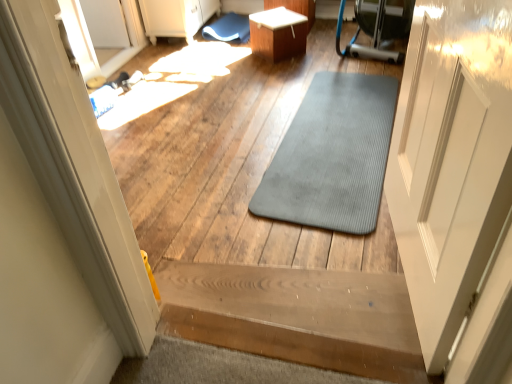
Consider the image. Measure the distance between wooden stairs at center and camera.

A distance of 1.05 meters exists between wooden stairs at center and camera.

The width and height of the screenshot is (512, 384). What do you see at coordinates (228, 29) in the screenshot?
I see `blue rubber bath mat at upper center` at bounding box center [228, 29].

Describe the element at coordinates (278, 33) in the screenshot. I see `white glossy table at upper center` at that location.

This screenshot has height=384, width=512. Find the location of `white glossy table at upper center`. white glossy table at upper center is located at coordinates click(x=278, y=33).

Describe the element at coordinates (113, 31) in the screenshot. I see `transparent glass door at upper left` at that location.

This screenshot has height=384, width=512. I want to click on gray rubber mat at center, so click(332, 155).

Considering the sizes of objects gray rubber mat at center and transparent glass door at upper left in the image provided, who is shorter, gray rubber mat at center or transparent glass door at upper left?

gray rubber mat at center.

Is point (343, 180) more distant than point (127, 20)?

No.

What's the angular difference between gray rubber mat at center and transparent glass door at upper left's facing directions?

91.6 degrees.

Is gray rubber mat at center inside the boundaries of transparent glass door at upper left, or outside?

gray rubber mat at center lies outside transparent glass door at upper left.

Measure the distance from blue rubber bath mat at upper center to white glossy table at upper center.

blue rubber bath mat at upper center and white glossy table at upper center are 20.06 inches apart.

Are blue rubber bath mat at upper center and white glossy table at upper center far apart?

No, blue rubber bath mat at upper center is not far from white glossy table at upper center.

Which is less distant, (244, 38) or (286, 10)?

Point (244, 38) appears to be farther away from the viewer than point (286, 10).

Is blue rubber bath mat at upper center positioned with its back to white glossy table at upper center?

blue rubber bath mat at upper center does not have its back to white glossy table at upper center.

Looking at this image, considering the sizes of objects wooden stairs at center and transparent glass door at upper left in the image provided, who is thinner, wooden stairs at center or transparent glass door at upper left?

transparent glass door at upper left is thinner.

Choose the correct answer: Is wooden stairs at center inside transparent glass door at upper left or outside it?

wooden stairs at center is spatially situated outside transparent glass door at upper left.

From a real-world perspective, who is located lower, wooden stairs at center or transparent glass door at upper left?

In real-world perspective, wooden stairs at center is lower.

Image resolution: width=512 pixels, height=384 pixels. What are the coordinates of `stairs below the transparent glass door at upper left (from a real-world perspective)` in the screenshot? It's located at (296, 316).

Is transparent glass door at upper left oriented away from blue rubber bath mat at upper center?

No.

Is transparent glass door at upper left to the right of blue rubber bath mat at upper center from the viewer's perspective?

No.

Consider the image. From the image's perspective, is transparent glass door at upper left above blue rubber bath mat at upper center?

No, from the image's perspective, transparent glass door at upper left is not over blue rubber bath mat at upper center.

Does transparent glass door at upper left have a lesser height compared to blue rubber bath mat at upper center?

No, transparent glass door at upper left is not shorter than blue rubber bath mat at upper center.

Is point (317, 133) positioned in front of point (212, 341)?

No, it is behind (212, 341).

In the image, is gray rubber mat at center positioned in front of or behind wooden stairs at center?

In the image, gray rubber mat at center appears behind wooden stairs at center.

From the image's perspective, does gray rubber mat at center appear lower than wooden stairs at center?

Incorrect, from the image's perspective, gray rubber mat at center is higher than wooden stairs at center.

Between gray rubber mat at center and wooden stairs at center, which one has larger size?

With larger size is wooden stairs at center.

Considering the sizes of white glossy table at upper center and gray rubber mat at center in the image, is white glossy table at upper center taller or shorter than gray rubber mat at center?

Considering their sizes, white glossy table at upper center has more height than gray rubber mat at center.

How many degrees apart are the facing directions of white glossy table at upper center and gray rubber mat at center?

The facing directions of white glossy table at upper center and gray rubber mat at center are 38.7 degrees apart.

Which of these two, white glossy table at upper center or gray rubber mat at center, is thinner?

Thinner between the two is white glossy table at upper center.

At what (x,y) coordinates should I click in order to perform the action: click on table that is above the gray rubber mat at center (from a real-world perspective). Please return your answer as a coordinate pair (x, y). The height and width of the screenshot is (384, 512). Looking at the image, I should click on (278, 33).

How many degrees apart are the facing directions of wooden stairs at center and blue rubber bath mat at upper center?

175 degrees separate the facing orientations of wooden stairs at center and blue rubber bath mat at upper center.

At what (x,y) coordinates should I click in order to perform the action: click on stairs on the right of blue rubber bath mat at upper center. Please return your answer as a coordinate pair (x, y). The width and height of the screenshot is (512, 384). Looking at the image, I should click on (296, 316).

Which is closer, (305, 330) or (208, 29)?

Clearly, point (305, 330) is closer to the camera than point (208, 29).

At what (x,y) coordinates should I click in order to perform the action: click on mat below the transparent glass door at upper left (from the image's perspective). Please return your answer as a coordinate pair (x, y). This screenshot has width=512, height=384. Looking at the image, I should click on (332, 155).

The width and height of the screenshot is (512, 384). In the image, there is a white glossy table at upper center. What are the coordinates of `bath mat above it (from the image's perspective)` in the screenshot? It's located at (228, 29).

Considering their positions, is transparent glass door at upper left positioned further to blue rubber bath mat at upper center than white glossy table at upper center?

transparent glass door at upper left is positioned further to the anchor blue rubber bath mat at upper center.

Considering their positions, is wooden stairs at center positioned further to gray rubber mat at center than white glossy table at upper center?

Based on the image, white glossy table at upper center appears to be further to gray rubber mat at center.

Looking at the image, which one is located further to white glossy table at upper center, transparent glass door at upper left or gray rubber mat at center?

transparent glass door at upper left is positioned further to the anchor white glossy table at upper center.

Considering their positions, is transparent glass door at upper left positioned closer to white glossy table at upper center than blue rubber bath mat at upper center?

blue rubber bath mat at upper center lies closer to white glossy table at upper center than the other object.

Consider the image. Considering their positions, is gray rubber mat at center positioned closer to blue rubber bath mat at upper center than white glossy table at upper center?

white glossy table at upper center is positioned closer to the anchor blue rubber bath mat at upper center.

Estimate the real-world distances between objects in this image. Which object is closer to blue rubber bath mat at upper center, white glossy table at upper center or wooden stairs at center?

Among the two, white glossy table at upper center is located nearer to blue rubber bath mat at upper center.

Based on their spatial positions, is white glossy table at upper center or gray rubber mat at center closer to blue rubber bath mat at upper center?

Among the two, white glossy table at upper center is located nearer to blue rubber bath mat at upper center.

Considering their positions, is blue rubber bath mat at upper center positioned closer to wooden stairs at center than transparent glass door at upper left?

transparent glass door at upper left.

At what (x,y) coordinates should I click in order to perform the action: click on table between gray rubber mat at center and blue rubber bath mat at upper center along the z-axis. Please return your answer as a coordinate pair (x, y). This screenshot has height=384, width=512. Looking at the image, I should click on (278, 33).

Identify the location of glass door located between wooden stairs at center and blue rubber bath mat at upper center in the depth direction. [113, 31].

You are a GUI agent. You are given a task and a screenshot of the screen. Output one action in this format:
    pyautogui.click(x=<x>, y=<y>)
    Task: Click on the mat between transparent glass door at upper left and wooden stairs at center vertically
    
    Given the screenshot: What is the action you would take?
    pyautogui.click(x=332, y=155)

The image size is (512, 384). In order to click on mat between wooden stairs at center and white glossy table at upper center from front to back in this screenshot , I will do `click(332, 155)`.